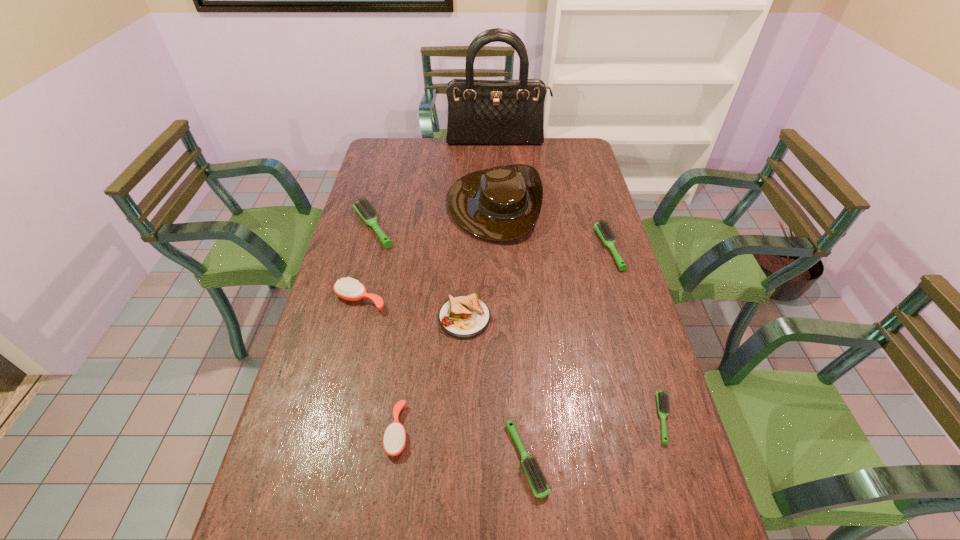
The height and width of the screenshot is (540, 960). I want to click on vacant area between the second biggest light hairbrush and the sandwich, so click(x=537, y=283).

I want to click on free spot between the leftmost light hairbrush and the cowboy hat, so click(433, 215).

You are a GUI agent. You are given a task and a screenshot of the screen. Output one action in this format:
    pyautogui.click(x=<x>, y=<y>)
    Task: Click on the free space between the seventh object from right to left and the left orange hairbrush
    
    Given the screenshot: What is the action you would take?
    pyautogui.click(x=379, y=365)

Identify the location of unoccupied area between the left orange hairbrush and the cowboy hat. (427, 252).

The width and height of the screenshot is (960, 540). I want to click on free point between the biggest light hairbrush and the sandwich, so click(419, 272).

You are a GUI agent. You are given a task and a screenshot of the screen. Output one action in this format:
    pyautogui.click(x=<x>, y=<y>)
    Task: Click on the vacant area between the bigger orange hairbrush and the second smallest light hairbrush
    The height and width of the screenshot is (540, 960).
    Given the screenshot: What is the action you would take?
    pyautogui.click(x=444, y=379)

Where is `object that is the fifth closest to the second tallest object`? The width and height of the screenshot is (960, 540). object that is the fifth closest to the second tallest object is located at coordinates (347, 288).

Identify which object is the fifth closest to the tallest object. Please provide its 2D coordinates. Your answer should be formatted as a tuple, i.e. [(x, y)], where the tuple contains the x and y coordinates of a point satisfying the conditions above.

[(466, 316)]

Locate which hairbrush ranks third in proximity to the biggest light hairbrush. Please provide its 2D coordinates. Your answer should be formatted as a tuple, i.e. [(x, y)], where the tuple contains the x and y coordinates of a point satisfying the conditions above.

[(605, 232)]

Select which hairbrush is the closest to the shortest object. Please provide its 2D coordinates. Your answer should be formatted as a tuple, i.e. [(x, y)], where the tuple contains the x and y coordinates of a point satisfying the conditions above.

[(539, 485)]